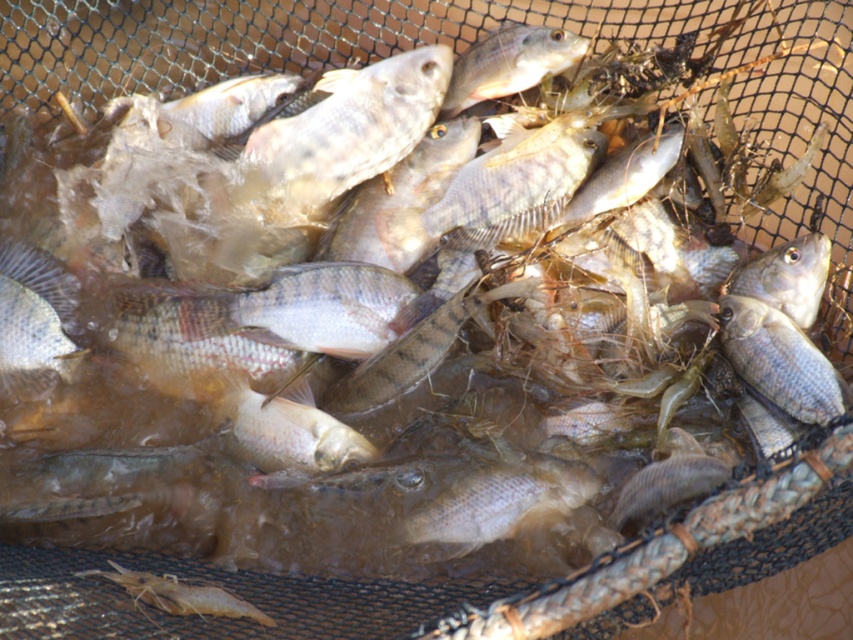
Does point (12, 317) come closer to viewer compared to point (724, 333)?

Yes, point (12, 317) is closer to viewer.

Which of these two, satin silver fish at center or shiny silver fish at center, stands taller?

Standing taller between the two is satin silver fish at center.

Where is `satin silver fish at center`? Image resolution: width=853 pixels, height=640 pixels. satin silver fish at center is located at coordinates (33, 323).

This screenshot has width=853, height=640. Find the location of `satin silver fish at center`. satin silver fish at center is located at coordinates (33, 323).

What do you see at coordinates (33, 323) in the screenshot? I see `satin silver fish at center` at bounding box center [33, 323].

Can you confirm if satin silver fish at center is positioned above shiny silver fish at upper center?

No, satin silver fish at center is not above shiny silver fish at upper center.

Describe the element at coordinates (33, 323) in the screenshot. Image resolution: width=853 pixels, height=640 pixels. I see `satin silver fish at center` at that location.

At what (x,y) coordinates should I click in order to perform the action: click on satin silver fish at center. Please return your answer as a coordinate pair (x, y). Image resolution: width=853 pixels, height=640 pixels. Looking at the image, I should click on (33, 323).

Does slightly translucent silver fish at center have a greater height compared to shiny silver fish at upper center?

Incorrect, slightly translucent silver fish at center's height is not larger of shiny silver fish at upper center's.

What do you see at coordinates (498, 502) in the screenshot? Image resolution: width=853 pixels, height=640 pixels. I see `slightly translucent silver fish at center` at bounding box center [498, 502].

Does point (550, 483) come behind point (550, 67)?

No, (550, 483) is closer to viewer.

Find the location of a particular element. The width and height of the screenshot is (853, 640). slightly translucent silver fish at center is located at coordinates (498, 502).